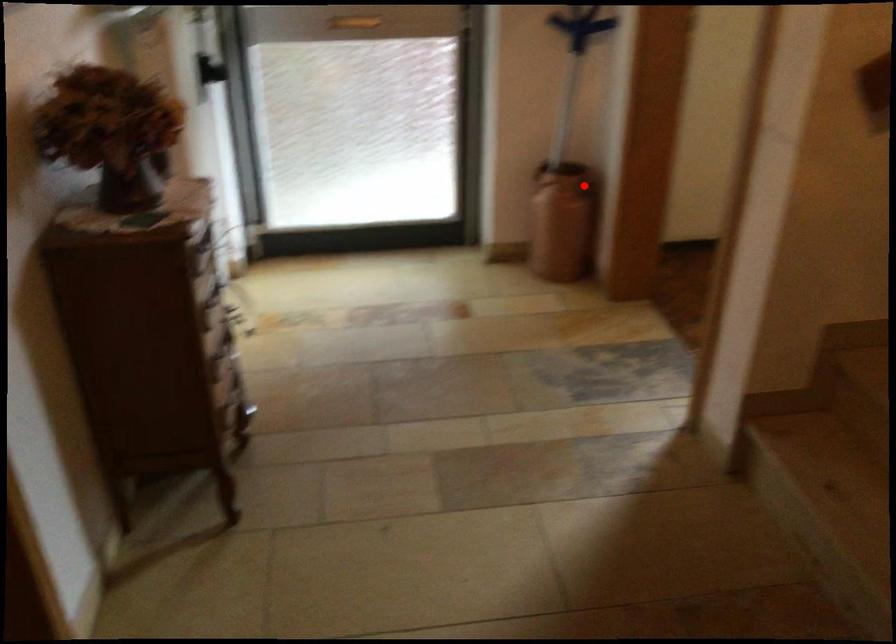
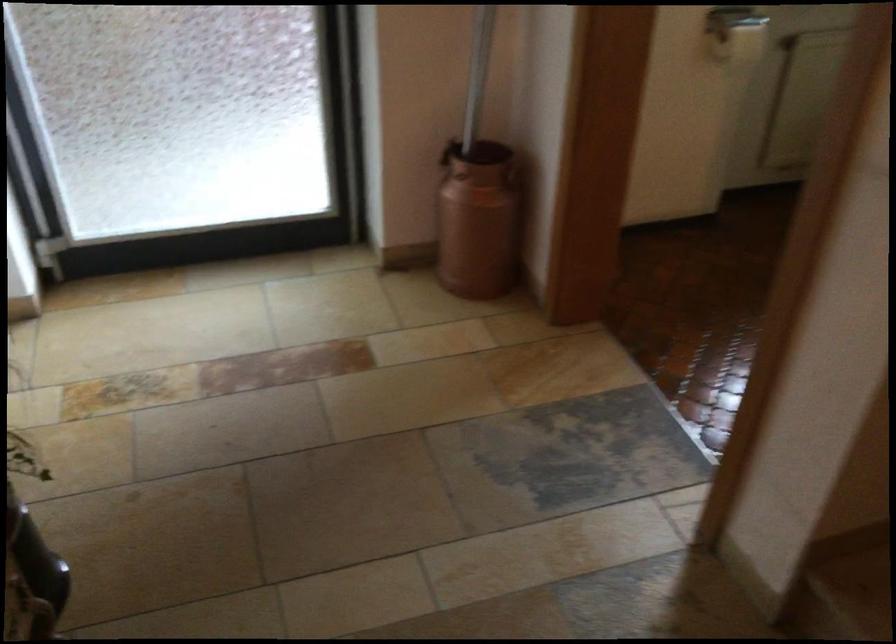
Where in the second image is the point corresponding to the highlighted location from the first image?

(513, 176)